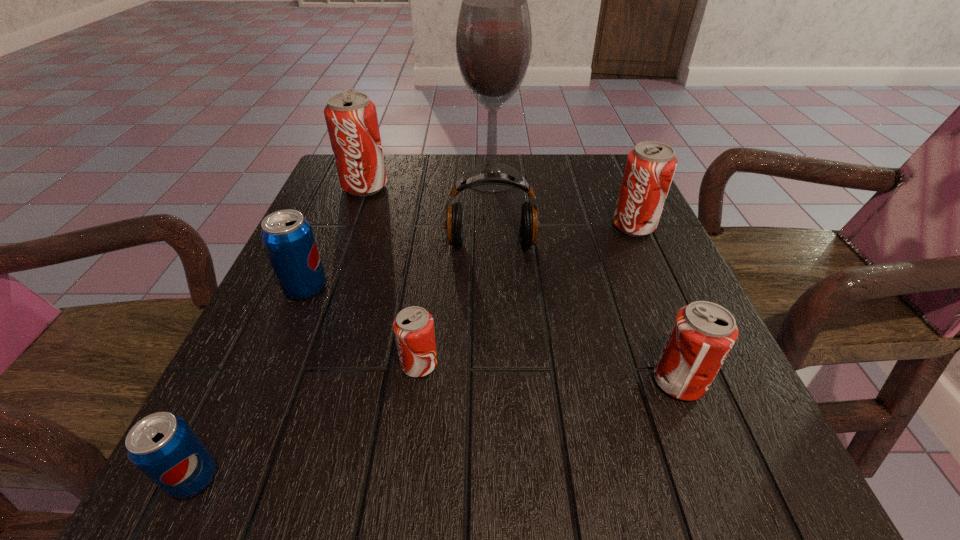
Where is `vacant space located 0.070m on the right of the third pink soda can from right to left`? This screenshot has width=960, height=540. vacant space located 0.070m on the right of the third pink soda can from right to left is located at coordinates (481, 364).

You are a GUI agent. You are given a task and a screenshot of the screen. Output one action in this format:
    pyautogui.click(x=<x>, y=<y>)
    Task: Click on the vacant space located 0.120m on the back of the smaller blue pop soda
    
    Given the screenshot: What is the action you would take?
    pyautogui.click(x=240, y=381)

Locate an element on the screen. Image resolution: width=960 pixels, height=540 pixels. alcohol located at the far edge is located at coordinates (494, 38).

Locate an element on the screen. soda can at the far edge is located at coordinates (351, 118).

At what (x,y) coordinates should I click in order to perform the action: click on object present at the near edge. Please return your answer as a coordinate pair (x, y). The image size is (960, 540). Looking at the image, I should click on (163, 446).

You are a GUI agent. You are given a task and a screenshot of the screen. Output one action in this format:
    pyautogui.click(x=<x>, y=<y>)
    Task: Click on the object located in the far left corner section of the desktop
    Image resolution: width=960 pixels, height=540 pixels.
    Given the screenshot: What is the action you would take?
    pyautogui.click(x=351, y=118)

Locate an element on the screen. object situated at the near left corner is located at coordinates (163, 446).

I want to click on vacant space at the far edge, so click(551, 164).

In the image, there is a desktop. At what (x,y) coordinates should I click in order to perform the action: click on vacant space at the near edge. Please return your answer as a coordinate pair (x, y). The height and width of the screenshot is (540, 960). Looking at the image, I should click on (353, 468).

You are a GUI agent. You are given a task and a screenshot of the screen. Output one action in this format:
    pyautogui.click(x=<x>, y=<y>)
    Task: Click on the vacant space at the left edge of the desktop
    The width and height of the screenshot is (960, 540).
    Given the screenshot: What is the action you would take?
    tap(367, 215)